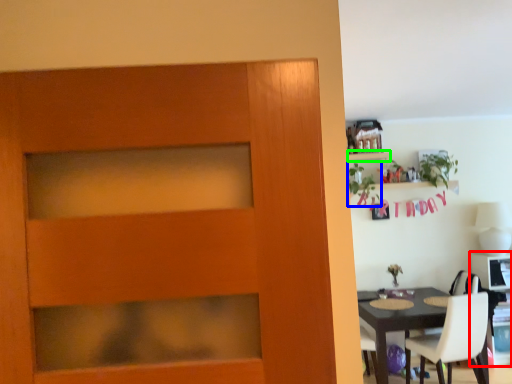
Question: Which is nearer to the computer desk (highlighted by a red box)? plant (highlighted by a blue box) or shelf (highlighted by a green box).

Choices:
 (A) plant
 (B) shelf

Answer: (A)